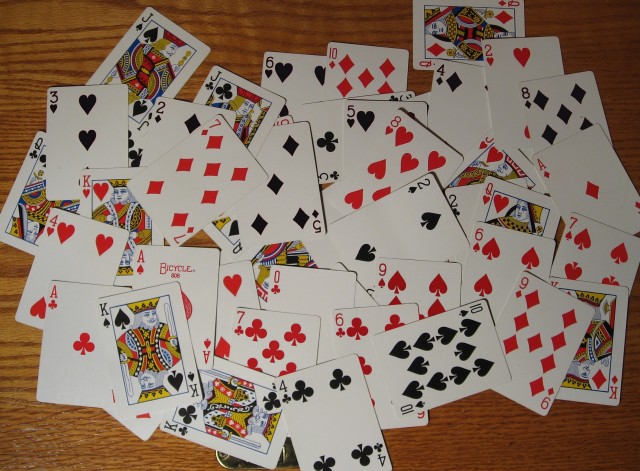
You are a GUI agent. You are given a task and a screenshot of the screen. Output one action in this format:
    pyautogui.click(x=<x>, y=<y>)
    Task: Click on the wooden table
    
    Given the screenshot: What is the action you would take?
    pyautogui.click(x=492, y=435), pyautogui.click(x=60, y=435), pyautogui.click(x=17, y=25), pyautogui.click(x=232, y=27)